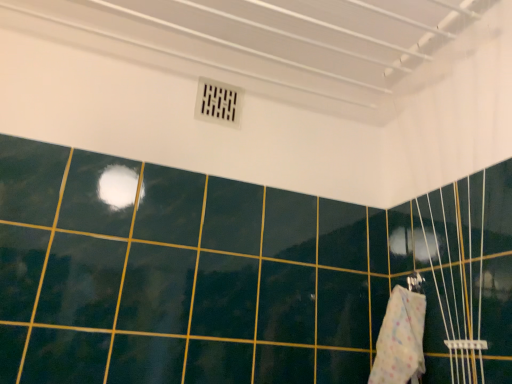
The width and height of the screenshot is (512, 384). Describe the element at coordinates (400, 339) in the screenshot. I see `white polka dot towel at lower right` at that location.

Where is `white polka dot towel at lower right`? The height and width of the screenshot is (384, 512). white polka dot towel at lower right is located at coordinates (400, 339).

Image resolution: width=512 pixels, height=384 pixels. What are the coordinates of `white polka dot towel at lower right` in the screenshot? It's located at (400, 339).